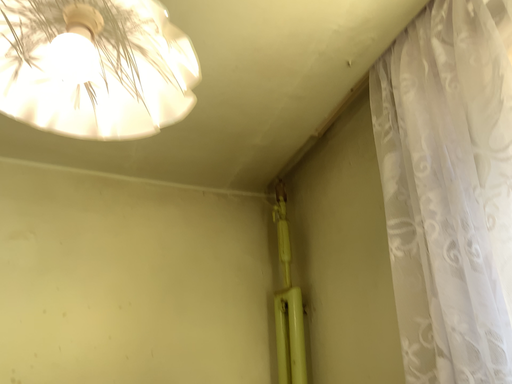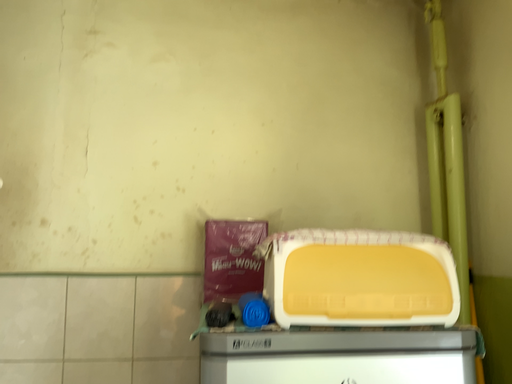
Question: How did the camera likely rotate when shooting the video?

Choices:
 (A) rotated right
 (B) rotated left

Answer: (B)